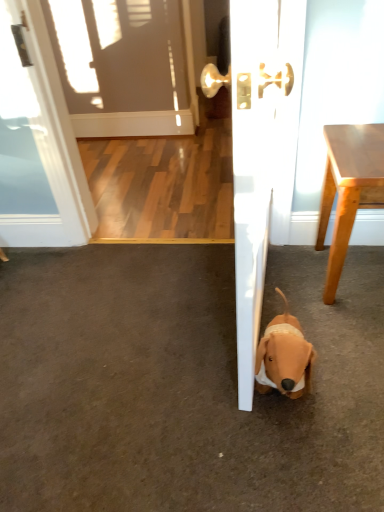
Where is `light brown wood table at right`? This screenshot has height=512, width=384. light brown wood table at right is located at coordinates (348, 189).

What do you see at coordinates (284, 357) in the screenshot? This screenshot has width=384, height=512. I see `soft plush dog at lower center` at bounding box center [284, 357].

Find the location of a particular element. The height and width of the screenshot is (512, 384). brown plush dog at lower right is located at coordinates (183, 383).

Considering the relative sizes of brown plush dog at lower right and white glossy door at center in the image provided, is brown plush dog at lower right smaller than white glossy door at center?

Yes, brown plush dog at lower right is smaller than white glossy door at center.

Image resolution: width=384 pixels, height=512 pixels. I want to click on concrete located behind the white glossy door at center, so click(x=183, y=383).

Is brown plush dog at lower right oriented towards white glossy door at center?

No, brown plush dog at lower right is not aimed at white glossy door at center.

From the image's perspective, which is below, soft plush dog at lower center or white glossy door at center?

soft plush dog at lower center, from the image's perspective.

Is point (302, 373) positioned behind point (248, 326)?

Yes, it is.

Based on the photo, is soft plush dog at lower center far from white glossy door at center?

No, there isn't a large distance between soft plush dog at lower center and white glossy door at center.

Considering the relative positions of soft plush dog at lower center and white glossy door at center in the image provided, is soft plush dog at lower center to the left of white glossy door at center from the viewer's perspective?

No.

Based on their sizes in the image, would you say white glossy door at center is bigger or smaller than brown plush dog at lower right?

Considering their sizes, white glossy door at center takes up more space than brown plush dog at lower right.

Which object is closer to the camera taking this photo, white glossy door at center or brown plush dog at lower right?

white glossy door at center is more forward.

Is white glossy door at center oriented away from brown plush dog at lower right?

No, white glossy door at center is not facing the opposite direction of brown plush dog at lower right.

From a real-world perspective, is white glossy door at center physically below brown plush dog at lower right?

No, from a real-world perspective, white glossy door at center is not beneath brown plush dog at lower right.

Is soft plush dog at lower center completely or partially inside brown plush dog at lower right?

Actually, soft plush dog at lower center is outside brown plush dog at lower right.

Measure the distance between brown plush dog at lower right and soft plush dog at lower center.

A distance of 12.39 inches exists between brown plush dog at lower right and soft plush dog at lower center.

From the image's perspective, who appears lower, brown plush dog at lower right or soft plush dog at lower center?

brown plush dog at lower right.

From a real-world perspective, which is physically below, brown plush dog at lower right or soft plush dog at lower center?

brown plush dog at lower right.

Is white glossy door at center facing away from light brown wood table at right?

white glossy door at center does not have its back to light brown wood table at right.

The width and height of the screenshot is (384, 512). What are the coordinates of `door in front of the light brown wood table at right` in the screenshot? It's located at (261, 157).

Consider the image. Between white glossy door at center and light brown wood table at right, which one has more height?

white glossy door at center.

Does white glossy door at center have a smaller size compared to light brown wood table at right?

No.

At what (x,y) coordinates should I click in order to perform the action: click on concrete on the left of light brown wood table at right. Please return your answer as a coordinate pair (x, y). The height and width of the screenshot is (512, 384). Looking at the image, I should click on (183, 383).

How much distance is there between brown plush dog at lower right and light brown wood table at right?

brown plush dog at lower right and light brown wood table at right are 20.62 inches apart.

Considering the relative positions of brown plush dog at lower right and light brown wood table at right in the image provided, is brown plush dog at lower right to the right of light brown wood table at right from the viewer's perspective?

No.

Is brown plush dog at lower right situated inside light brown wood table at right or outside?

The correct answer is: outside.

Based on the photo, which of these two, light brown wood table at right or white glossy door at center, is smaller?

light brown wood table at right is smaller.

From a real-world perspective, is light brown wood table at right located higher than white glossy door at center?

No, from a real-world perspective, light brown wood table at right is not over white glossy door at center

How many degrees apart are the facing directions of light brown wood table at right and white glossy door at center?

The angle between the facing direction of light brown wood table at right and the facing direction of white glossy door at center is 4.15 degrees.

Is light brown wood table at right far away from white glossy door at center?

No, there isn't a large distance between light brown wood table at right and white glossy door at center.

At what (x,y) coordinates should I click in order to perform the action: click on door in front of the brown plush dog at lower right. Please return your answer as a coordinate pair (x, y). The width and height of the screenshot is (384, 512). Looking at the image, I should click on (261, 157).

The image size is (384, 512). I want to click on dog lying below the white glossy door at center (from the image's perspective), so click(x=284, y=357).

Based on their spatial positions, is brown plush dog at lower right or light brown wood table at right further from white glossy door at center?

Among the two, brown plush dog at lower right is located further to white glossy door at center.

Which object lies further to the anchor point brown plush dog at lower right, white glossy door at center or soft plush dog at lower center?

The object further to brown plush dog at lower right is white glossy door at center.

From the picture: Looking at the image, which one is located further to light brown wood table at right, brown plush dog at lower right or white glossy door at center?

brown plush dog at lower right.

Which object lies nearer to the anchor point white glossy door at center, soft plush dog at lower center or brown plush dog at lower right?

Among the two, soft plush dog at lower center is located nearer to white glossy door at center.

When comparing their distances from brown plush dog at lower right, does soft plush dog at lower center or white glossy door at center seem closer?

Among the two, soft plush dog at lower center is located nearer to brown plush dog at lower right.

Based on their spatial positions, is light brown wood table at right or soft plush dog at lower center further from white glossy door at center?

soft plush dog at lower center is further to white glossy door at center.

Looking at the image, which one is located further to light brown wood table at right, soft plush dog at lower center or brown plush dog at lower right?

brown plush dog at lower right is positioned further to the anchor light brown wood table at right.

Estimate the real-world distances between objects in this image. Which object is further from brown plush dog at lower right, light brown wood table at right or white glossy door at center?

The object further to brown plush dog at lower right is white glossy door at center.

Locate an element on the screen. Image resolution: width=384 pixels, height=512 pixels. dog between white glossy door at center and brown plush dog at lower right from top to bottom is located at coordinates (284, 357).

At what (x,y) coordinates should I click in order to perform the action: click on dog situated between brown plush dog at lower right and light brown wood table at right from left to right. Please return your answer as a coordinate pair (x, y). This screenshot has height=512, width=384. Looking at the image, I should click on (284, 357).

You are a GUI agent. You are given a task and a screenshot of the screen. Output one action in this format:
    pyautogui.click(x=<x>, y=<y>)
    Task: Click on the door located between brown plush dog at lower right and light brown wood table at right in the left-right direction
    This screenshot has height=512, width=384.
    Given the screenshot: What is the action you would take?
    pyautogui.click(x=261, y=157)

This screenshot has height=512, width=384. I want to click on dog between white glossy door at center and light brown wood table at right from front to back, so click(284, 357).